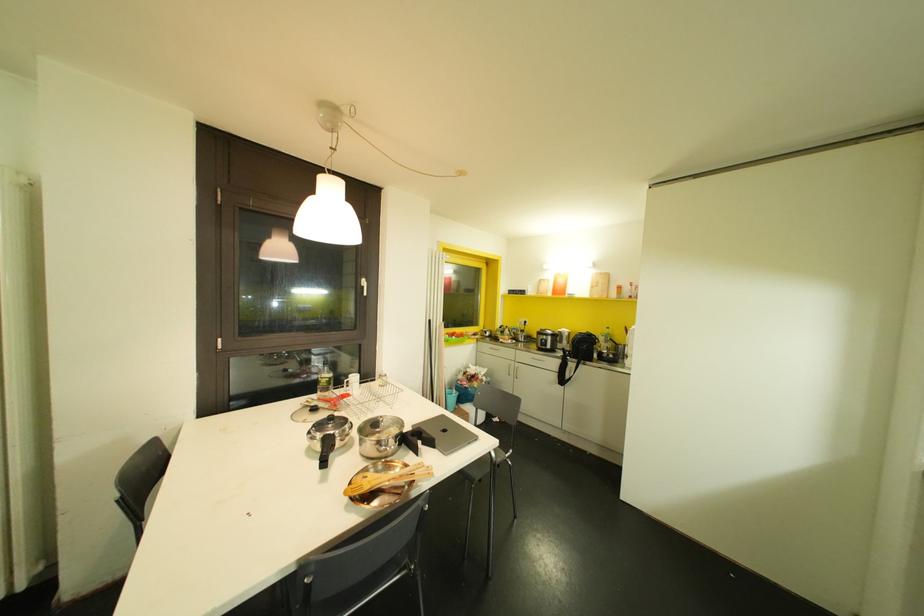
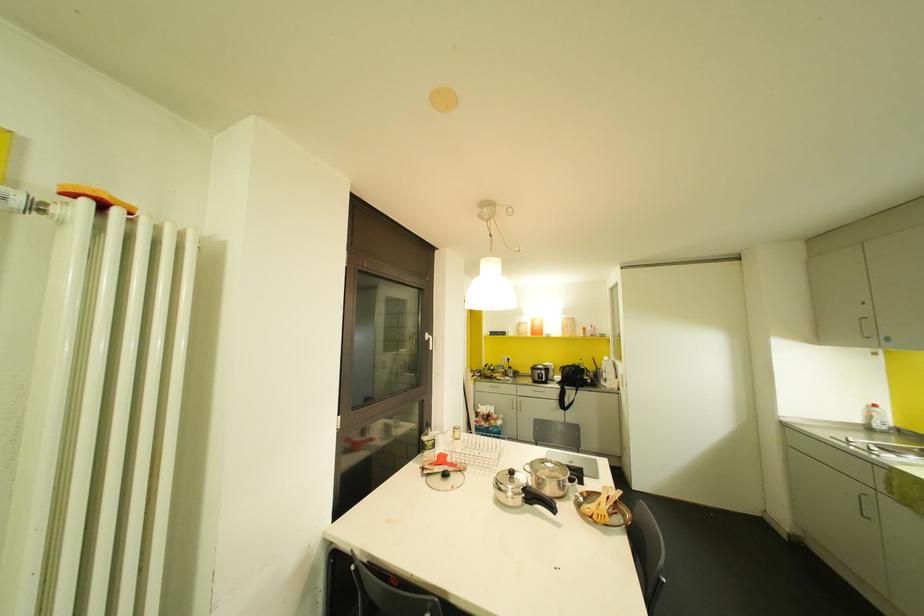
Where in the second image is the point corresponding to (x=322, y=379) from the first image?

(429, 444)